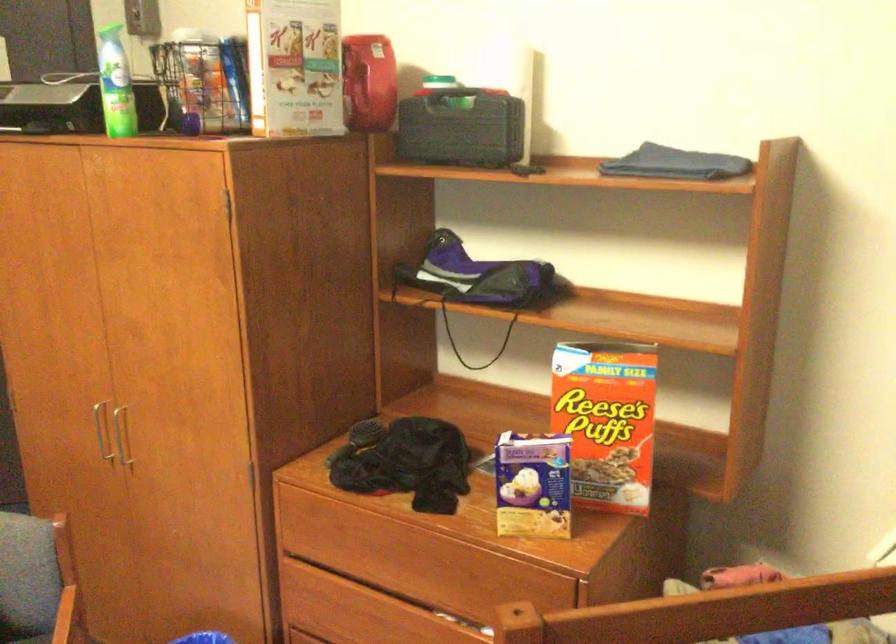
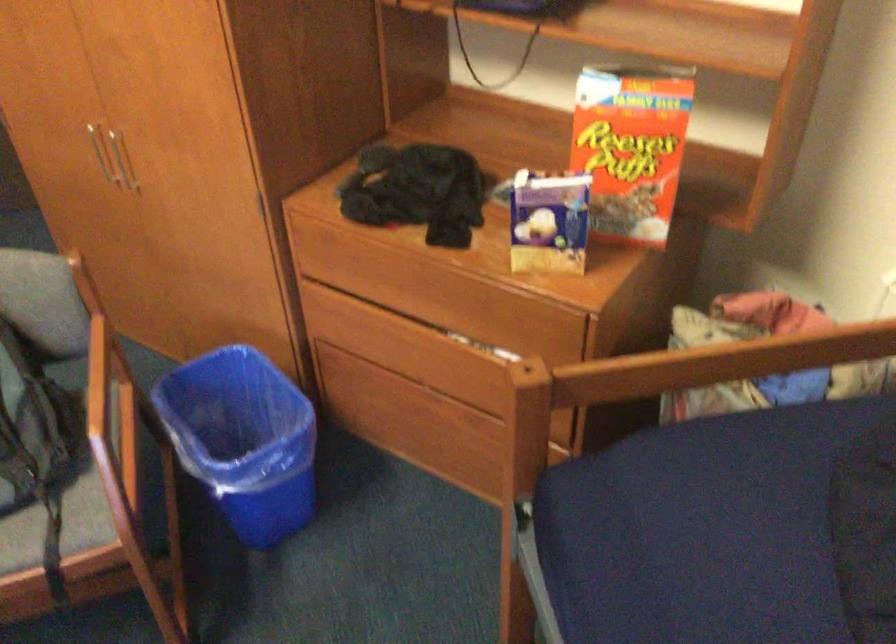
Question: Which direction would the cameraman need to move to produce the second image? Reply with the corresponding letter.

Choices:
 (A) Left
 (B) Right
 (C) Forward
 (D) Backward

Answer: (C)